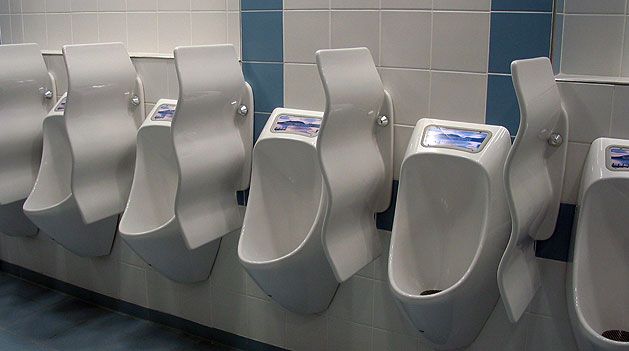
Where is `wavy urinal dividers`? The height and width of the screenshot is (351, 629). wavy urinal dividers is located at coordinates click(x=19, y=70), click(x=102, y=74), click(x=201, y=69), click(x=352, y=73), click(x=535, y=86).